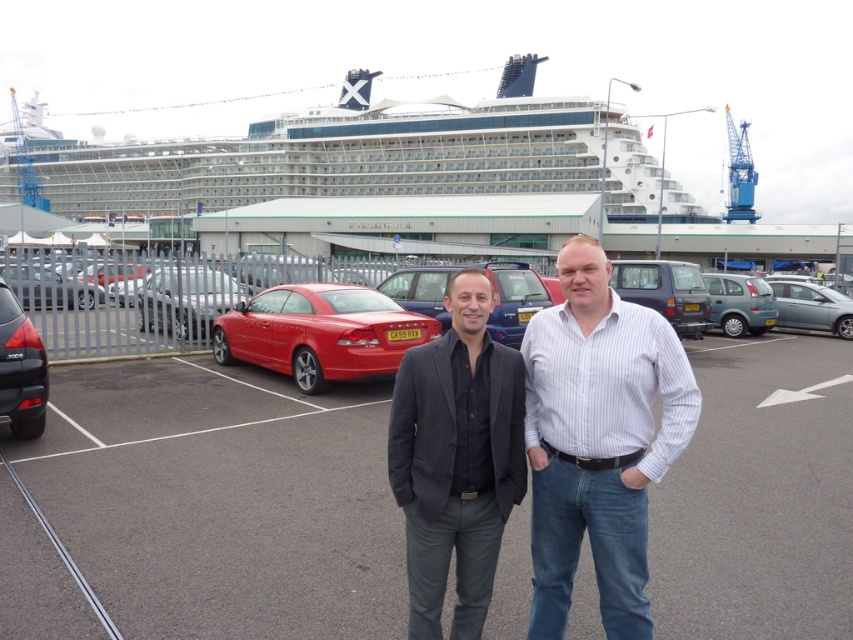
You are a photographer trying to capture a photo of both the white glossy cruise ship at upper center and the teal matte hatchback at center right. However, you notice that one of them is partially blocking your view of the other. Which object is closer to you, causing the obstruction?

The white glossy cruise ship at upper center is closer to you, so it is blocking the view of the teal matte hatchback at center right.

You are standing in a parking lot in front of a large cruise ship docked at a terminal. You see a point marked at coordinates (625,561). If you want to place a 3 meter long banner from your current position to that point, will it reach?

The point at (625,561) is 2.78 meters away from you. Since the banner is 3 meters long, it will reach and extend beyond the point.